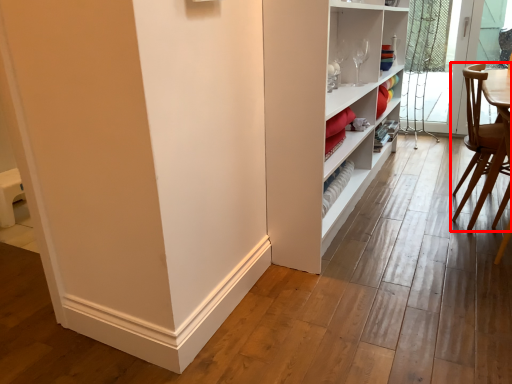
Question: From the image, what is the correct spatial relationship of chair (annotated by the red box) in relation to screen door?

Choices:
 (A) left
 (B) right

Answer: (A)